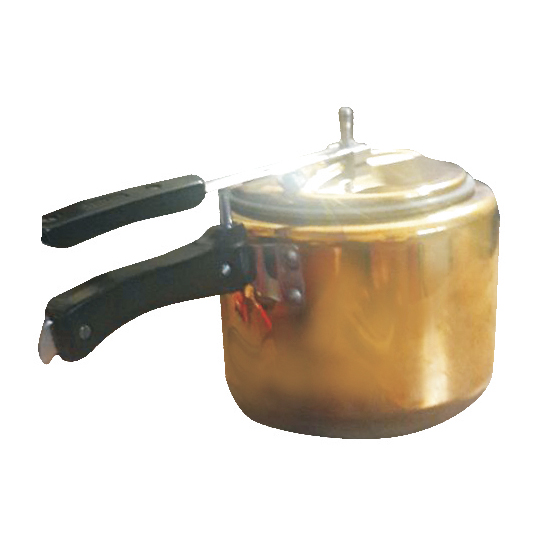
The image size is (540, 540). Identify the location of handles. tap(100, 208), tap(107, 290).